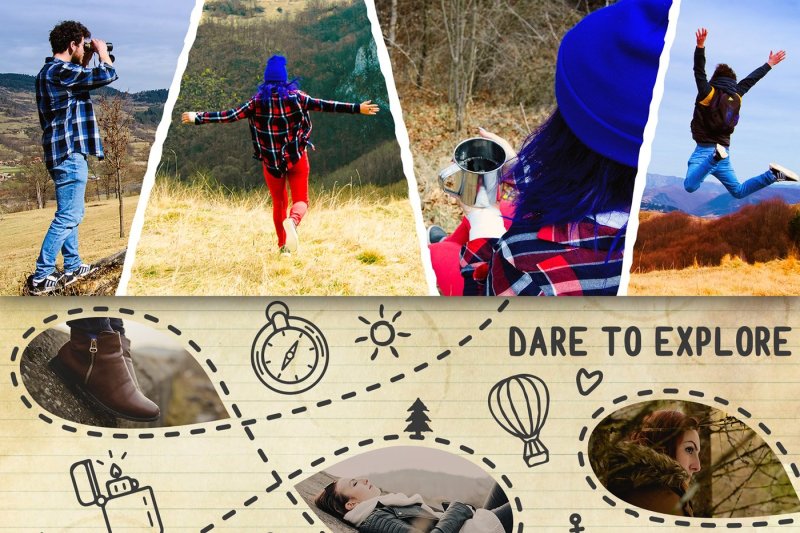
What are the coordinates of `clock sketch` in the screenshot? It's located at (284, 345).